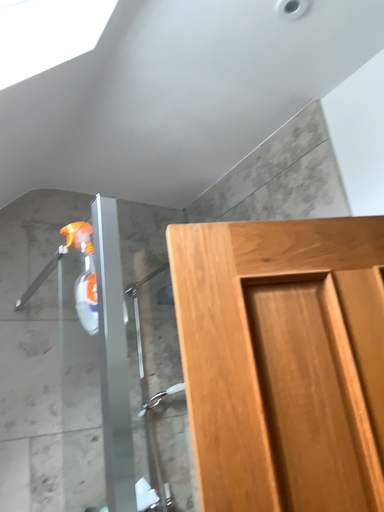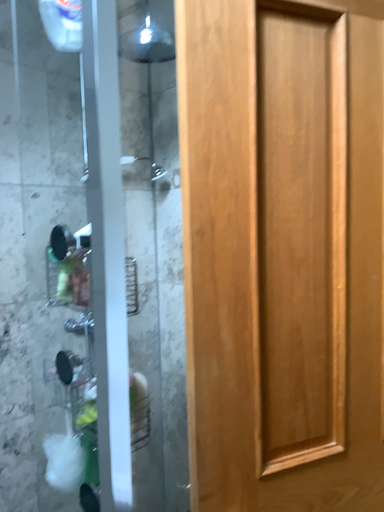
Question: How did the camera likely rotate when shooting the video?

Choices:
 (A) rotated right
 (B) rotated left

Answer: (A)